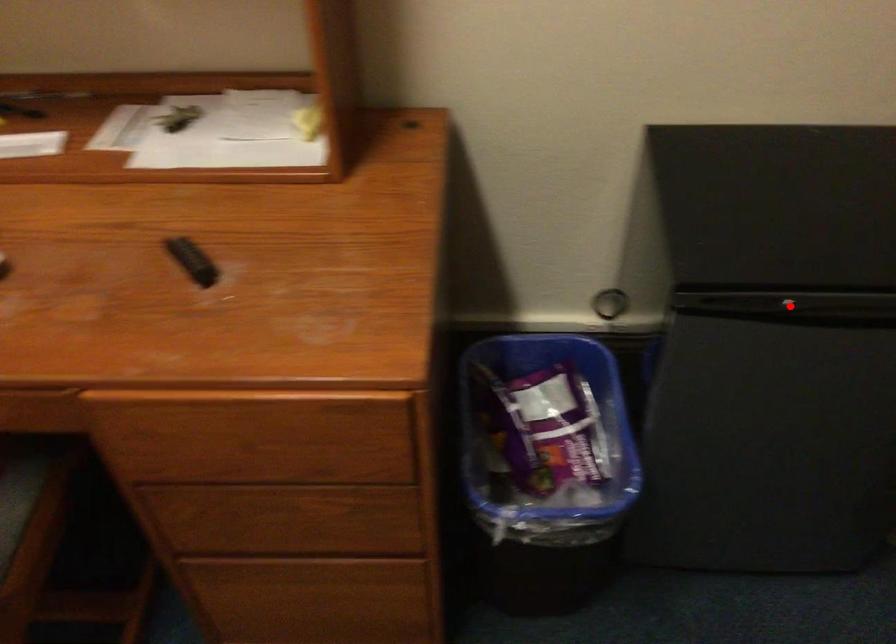
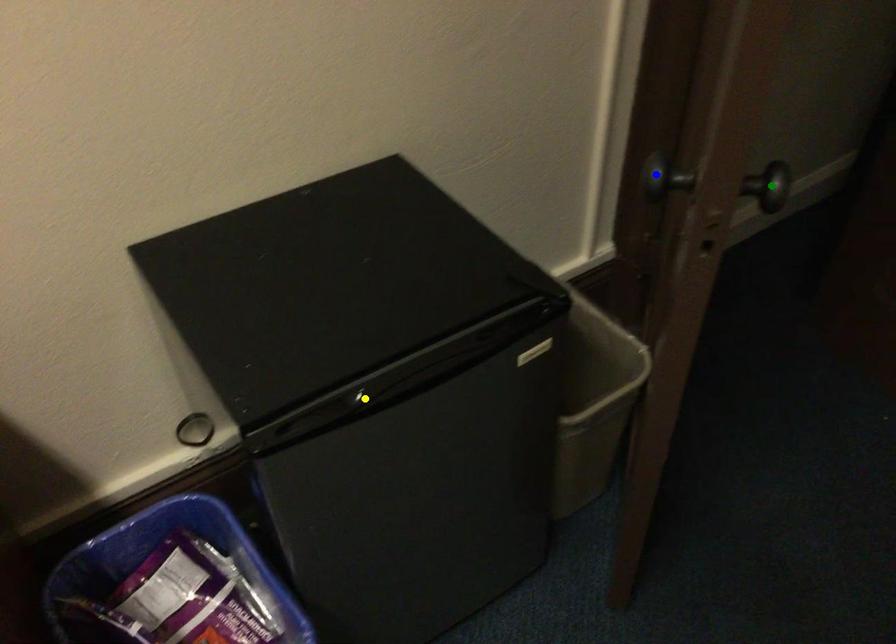
Question: I am providing you with two images of the same scene from different viewpoints. A red point is marked on the first image. You are given multiple points on the second image. Which point in image 2 represents the same 3d spot as the red point in image 1?

Choices:
 (A) blue point
 (B) yellow point
 (C) green point

Answer: (B)